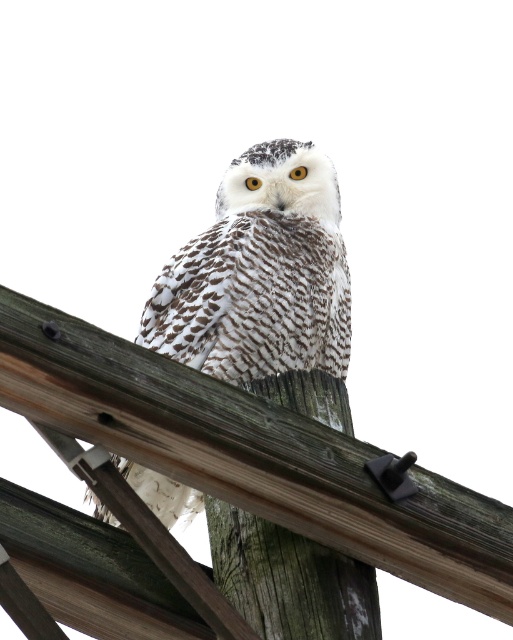
You are a birdwatcher observing the scene. You notice the white speckled owl at center and the wooden at center. Which object is located to the right of the other?

The wooden at center is located to the right of the white speckled owl at center because the owl is positioned on the left side of the wooden at center.

You are a wildlife photographer aiming to capture a closeup shot of the white speckled owl at center. Your camera has a maximum zoom range of 5 meters. Can you get a clear closeup without moving closer physically?

The white speckled owl at center is 8.21 meters away from the camera. Since the camera can only zoom up to 5 meters, you cannot get a clear closeup without moving closer physically.